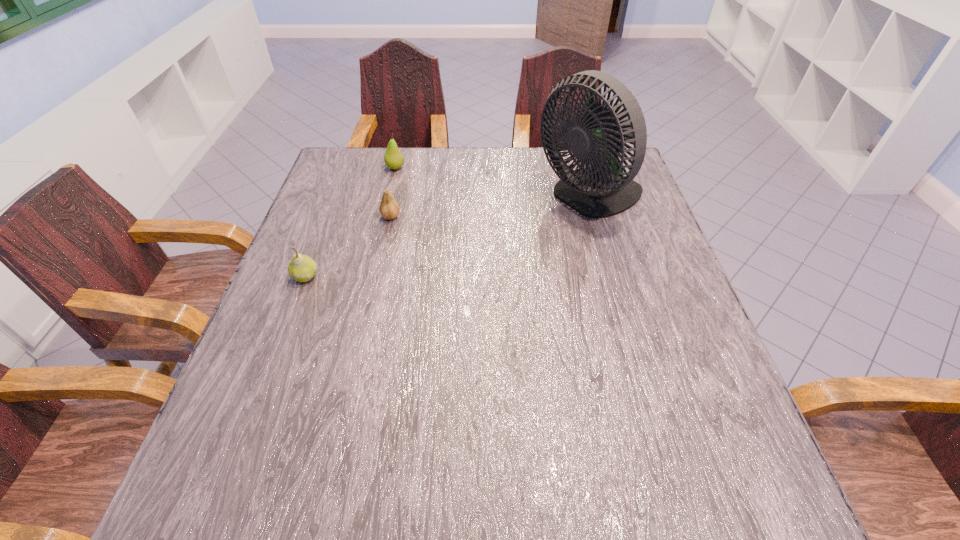
The image size is (960, 540). I want to click on fan, so click(x=599, y=188).

Locate an element on the screen. The width and height of the screenshot is (960, 540). the rightmost object is located at coordinates (599, 188).

Find the location of `the farthest pear`. the farthest pear is located at coordinates (393, 158).

Find the location of a particular element. The width and height of the screenshot is (960, 540). the leftmost pear is located at coordinates (302, 268).

Find the location of a particular element. This screenshot has height=540, width=960. the nearest pear is located at coordinates (302, 268).

Find the location of a particular element. The height and width of the screenshot is (540, 960). the second nearest pear is located at coordinates (389, 209).

What are the coordinates of `free location located 0.190m in front of the rightmost object to direct airflow` in the screenshot? It's located at (467, 198).

Locate an element on the screen. This screenshot has height=540, width=960. vacant space located in front of the rightmost object to direct airflow is located at coordinates [499, 198].

Find the location of a particular element. Image resolution: width=960 pixels, height=540 pixels. free point located in front of the rightmost object to direct airflow is located at coordinates (405, 198).

Locate an element on the screen. This screenshot has width=960, height=540. free location located 0.170m on the left of the farthest pear is located at coordinates (328, 168).